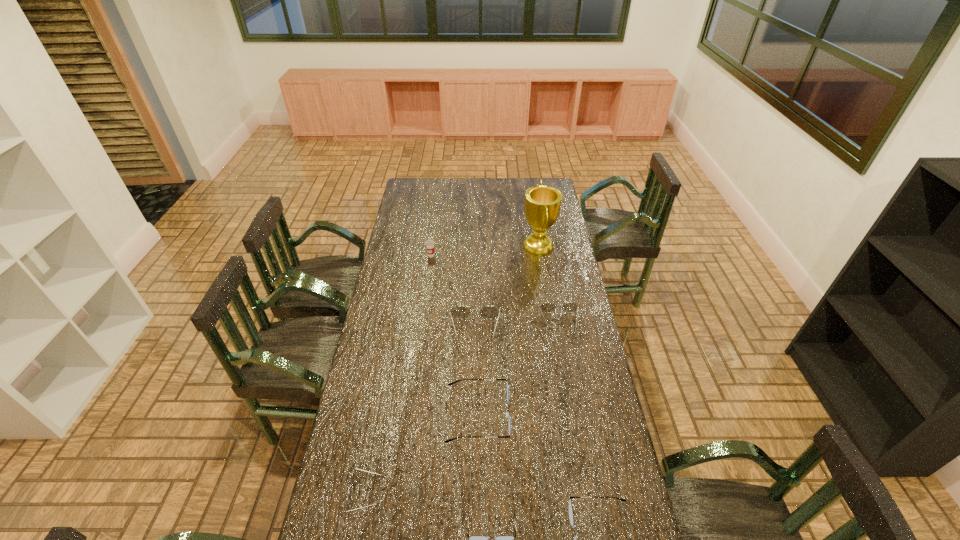
Locate an element on the screen. golden award is located at coordinates (542, 203).

At what (x,y) coordinates should I click in order to perform the action: click on the tallest object. Please return your answer as a coordinate pair (x, y). Looking at the image, I should click on click(x=542, y=203).

Identify the location of cup. The image size is (960, 540). (429, 243).

Locate an element on the screen. The image size is (960, 540). the seventh object from right to left is located at coordinates (429, 243).

Locate an element on the screen. The width and height of the screenshot is (960, 540). the second yellow spectacles from left to right is located at coordinates (460, 312).

Where is `the fifth farthest object`? the fifth farthest object is located at coordinates (507, 414).

I want to click on the biggest black spectacles, so tap(507, 414).

This screenshot has height=540, width=960. I want to click on the rightmost yellow spectacles, so click(547, 307).

Image resolution: width=960 pixels, height=540 pixels. Find the location of `the leftmost object`. the leftmost object is located at coordinates (353, 478).

This screenshot has width=960, height=540. I want to click on the smallest yellow spectacles, so click(x=353, y=478).